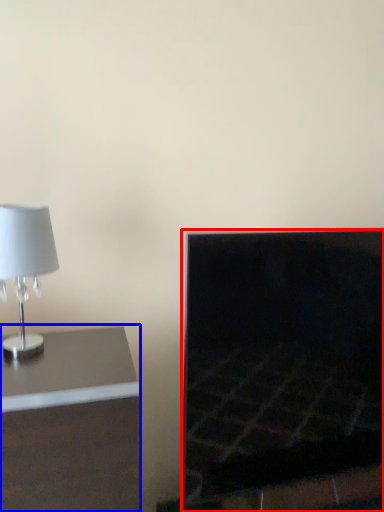
Question: Which object appears closest to the camera in this image, fireplace (highlighted by a red box) or furniture (highlighted by a blue box)?

Choices:
 (A) fireplace
 (B) furniture

Answer: (B)